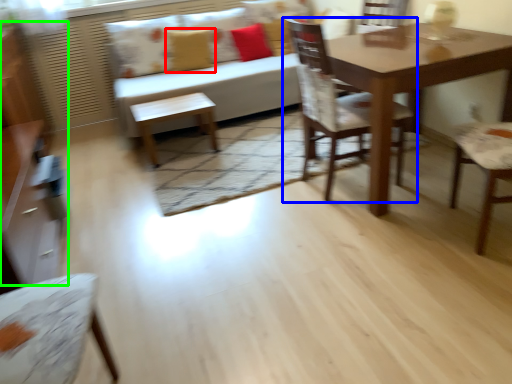
Question: Which object is the closest to the pillow (highlighted by a red box)? Choose among these: chair (highlighted by a blue box) or dresser (highlighted by a green box).

Choices:
 (A) chair
 (B) dresser

Answer: (B)